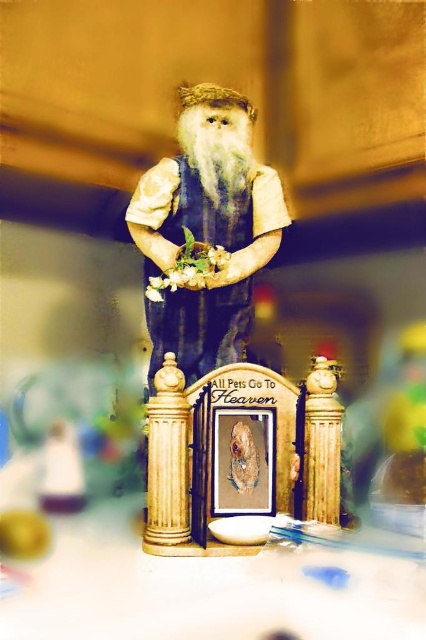
Question: Can you confirm if matte brown figurine at center is thinner than white fluffy beard at center?

Choices:
 (A) no
 (B) yes

Answer: (A)

Question: Among these objects, which one is nearest to the camera?

Choices:
 (A) matte brown figurine at center
 (B) white fluffy beard at center

Answer: (A)

Question: Is matte brown figurine at center bigger than white fluffy beard at center?

Choices:
 (A) yes
 (B) no

Answer: (A)

Question: Is matte brown figurine at center closer to camera compared to white fluffy beard at center?

Choices:
 (A) yes
 (B) no

Answer: (A)